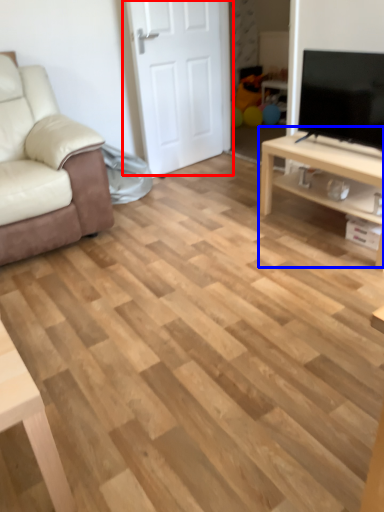
Question: Which point is further to the camera, door (highlighted by a red box) or table (highlighted by a blue box)?

Choices:
 (A) door
 (B) table

Answer: (A)